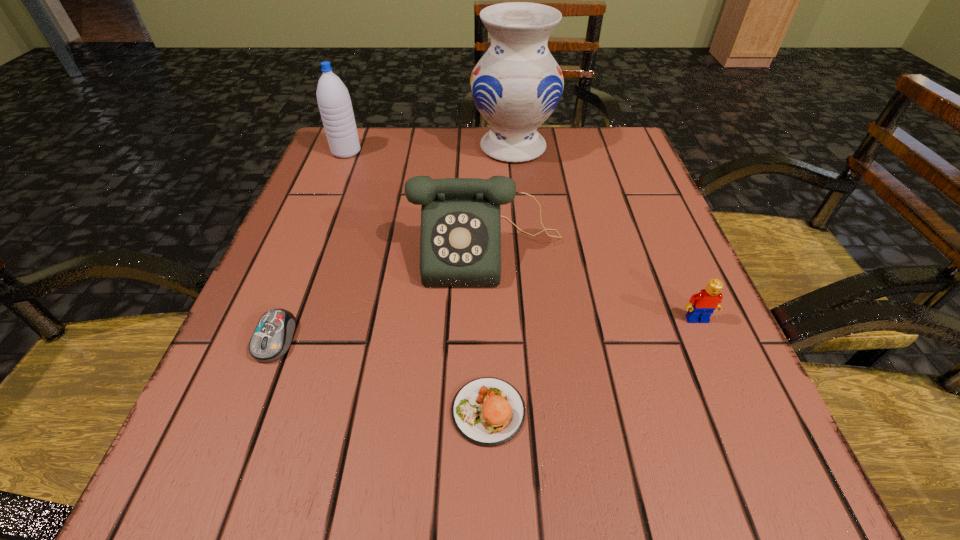
Locate an element on the screen. The width and height of the screenshot is (960, 540). empty location between the fourth shortest object and the fourth tallest object is located at coordinates (592, 285).

The width and height of the screenshot is (960, 540). In order to click on free space between the patty and the rightmost object in this screenshot , I will do `click(592, 365)`.

What are the coordinates of `unoccupied area between the Lego and the computer mouse` in the screenshot? It's located at (487, 329).

The width and height of the screenshot is (960, 540). I want to click on free spot between the fifth shortest object and the nearest object, so click(418, 281).

Point out which object is positioned as the fourth nearest to the water bottle. Please provide its 2D coordinates. Your answer should be formatted as a tuple, i.e. [(x, y)], where the tuple contains the x and y coordinates of a point satisfying the conditions above.

[(487, 411)]

The width and height of the screenshot is (960, 540). What are the coordinates of `object that is the closest to the computer mouse` in the screenshot? It's located at (460, 241).

Locate an element on the screen. The image size is (960, 540). vacant space that satisfies the following two spatial constraints: 1. on the wheel side of the computer mouse; 2. on the left side of the nearest object is located at coordinates (248, 411).

Where is `vacant point that satisfies the following two spatial constraints: 1. on the wheel side of the patty; 2. on the left side of the computer mouse`? This screenshot has width=960, height=540. vacant point that satisfies the following two spatial constraints: 1. on the wheel side of the patty; 2. on the left side of the computer mouse is located at coordinates (248, 411).

Where is `vacant region that satisfies the following two spatial constraints: 1. on the wheel side of the nearest object; 2. on the right side of the computer mouse`? vacant region that satisfies the following two spatial constraints: 1. on the wheel side of the nearest object; 2. on the right side of the computer mouse is located at coordinates (248, 411).